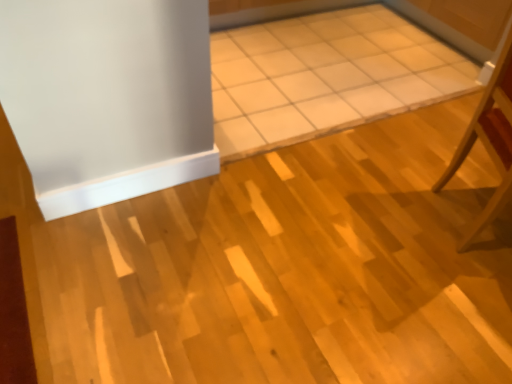
Identify the location of free location in front of wooden folding chair at right. The height and width of the screenshot is (384, 512). (467, 295).